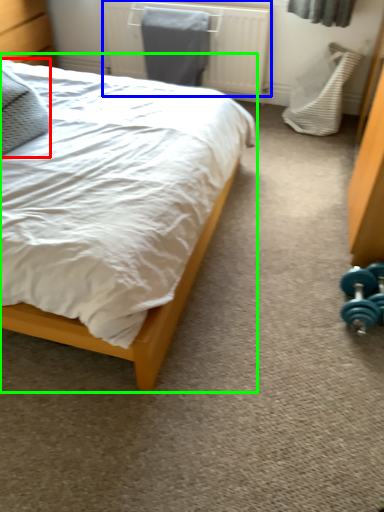
Question: Which is nearer to the pillow (highlighted by a red box)? radiator (highlighted by a blue box) or bed (highlighted by a green box).

Choices:
 (A) radiator
 (B) bed

Answer: (B)